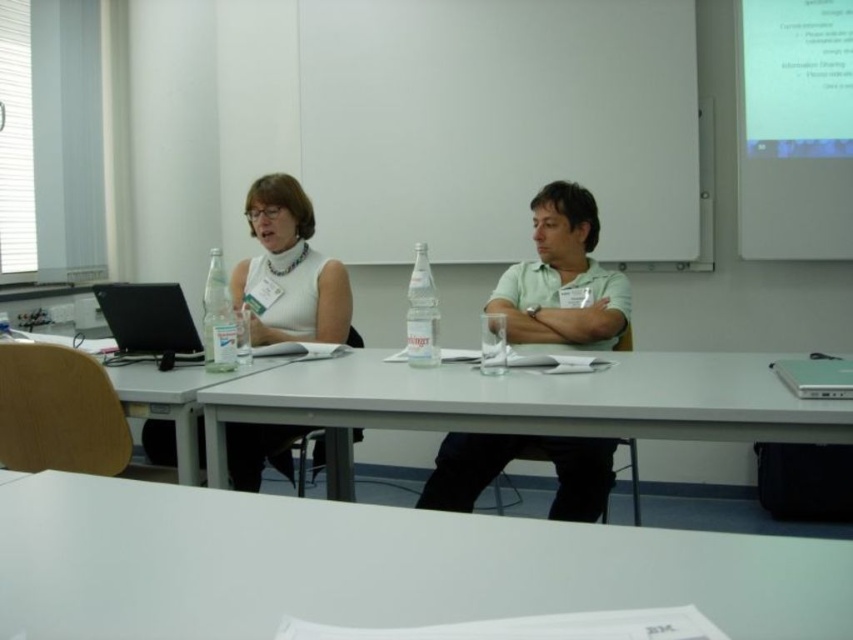
You are organizing a tech conference and need to decide which laptop to use for a presentation. The black glossy laptop at left and the silver metallic laptop at right are available. Based on their sizes, which one would be better for displaying content to the audience?

The black glossy laptop at left is bigger than the silver metallic laptop at right, so it would be better for displaying content to the audience because a larger screen size allows for better visibility and presentation.

You are attending a conference and need to reach for the clear plastic bottle at center without disturbing the green matte shirt at center. Is this possible?

The green matte shirt at center is above the clear plastic bottle at center, so you can reach the clear plastic bottle at center by moving under the shirt.

You are organizing a small event and need to place a decorative centerpiece on the wooden table at left. Considering the size of the clear plastic bottle at center already on the table, will the table have enough space for the centerpiece?

The wooden table at left has a larger size compared to the clear plastic bottle at center, so there should be sufficient space to place the decorative centerpiece alongside the existing bottle.